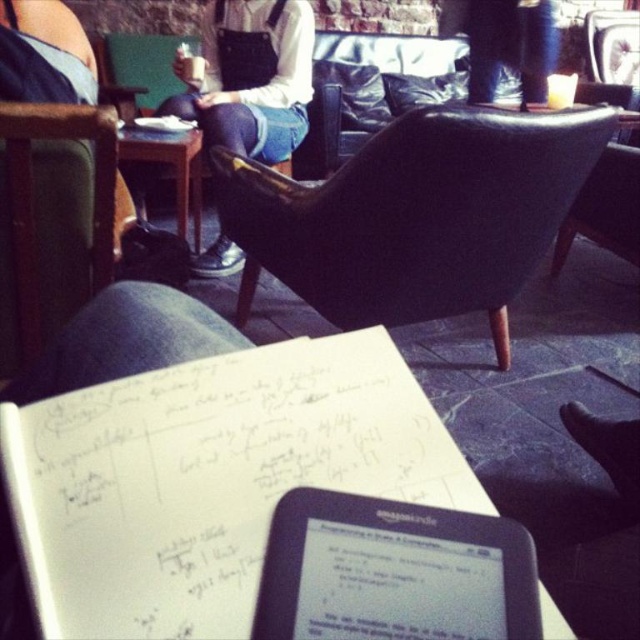
You are organizing a small meeting and need to place a 12x12 inch whiteboard on the wooden table at lower left and the white paper notepad at center. Which surface can accommodate the whiteboard without overlapping?

The wooden table at lower left is bigger than the white paper notepad at center, so the whiteboard can be placed on the wooden table at lower left without overlapping.

You are standing in the room and want to place a small plant between the two points labeled as point (364,529) and point (42,141). Which point should the plant be closer to in order to be nearer to the viewer?

The plant should be closer to point (364,529) because it is nearer to the viewer compared to point (42,141).